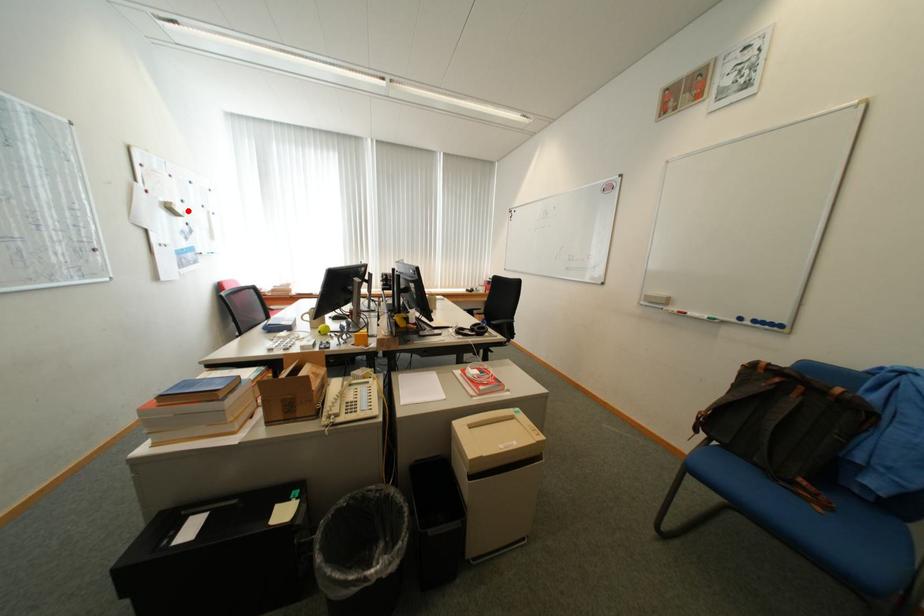
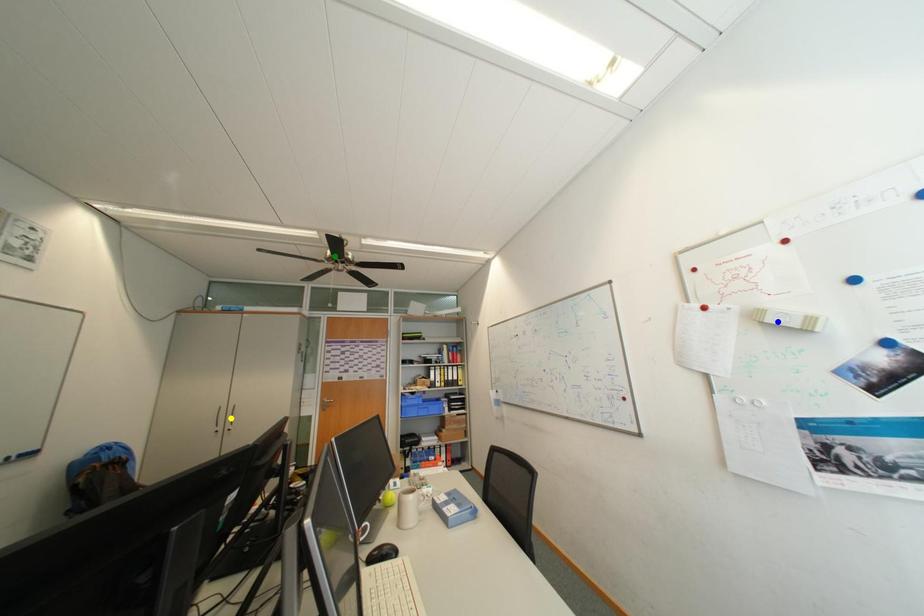
Question: I am providing you with two images of the same scene from different viewpoints. A red point is marked on the first image. You are given multiple points on the second image. Which mark in image 2 goes with the point in image 1?

Choices:
 (A) green point
 (B) yellow point
 (C) blue point

Answer: (C)